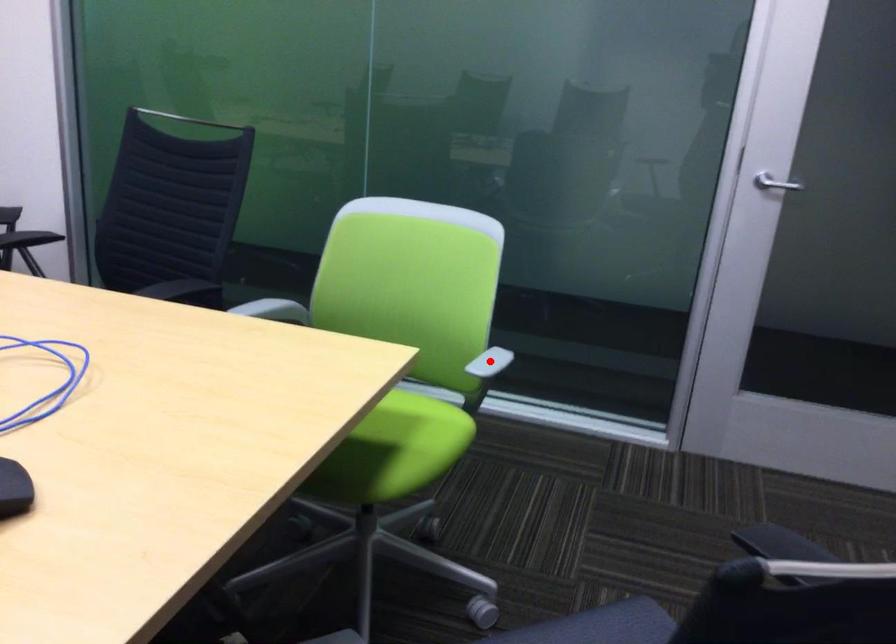
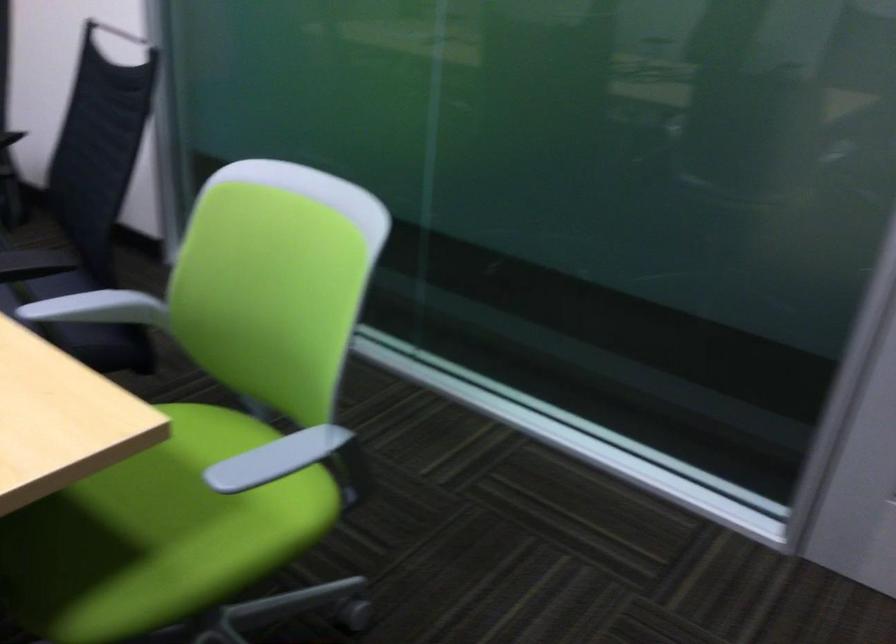
Question: I am providing you with two images of the same scene from different viewpoints. Image1 has a red point marked. In image2, the corresponding 3D location appears at what relative position? Reply with the corresponding letter.

Choices:
 (A) Closer
 (B) Farther

Answer: (A)